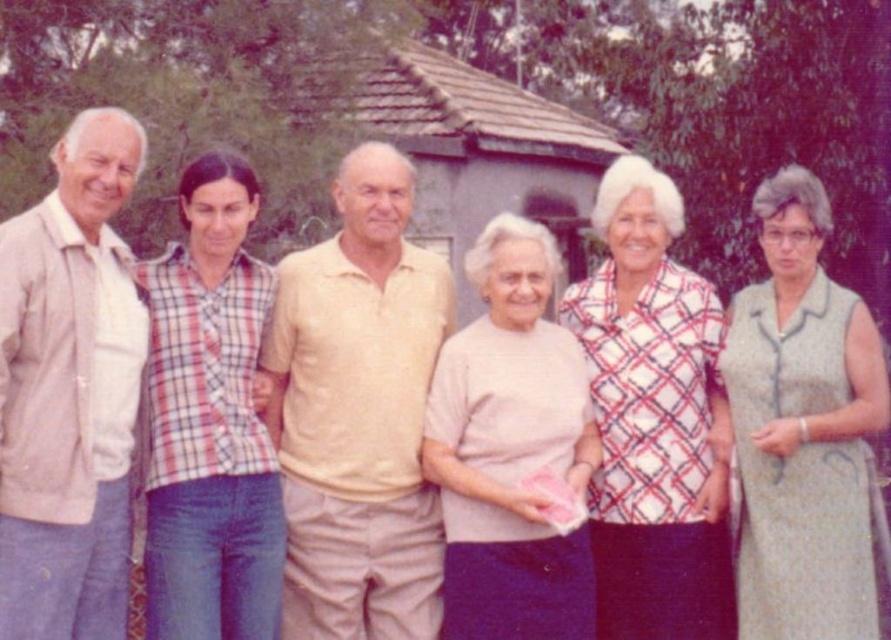
From the picture: You are a photographer trying to capture a group photo of the six people in the garden. The two central subjects are wearing a light yellow cotton shirt at center and a plaid cotton shirt at center. If you need to ensure there is at least 20 inches of space between them for better composition, will the current distance work?

The light yellow cotton shirt at center is 19.80 inches from the plaid cotton shirt at center, which is slightly less than the required 20 inches. Therefore, the current distance does not meet the requirement, and they should move slightly apart to achieve the desired spacing.

You are standing at the origin point of the coordinate system in the image. You want to move towards the light yellow cotton shirt at center. What direction should you move in?

Since the light yellow cotton shirt at center is located at coordinate point 0.647 on the x axis and 0.403 on the y axis, you should move towards the right and slightly forward to reach it.